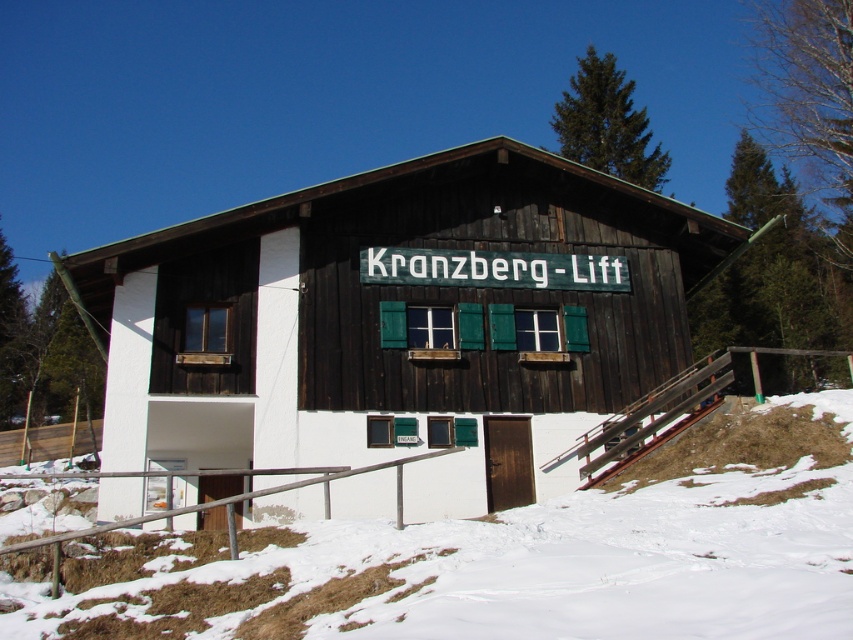
Question: Considering the real-world distances, which object is closest to the wooden cabin at center?

Choices:
 (A) white powdery snow at lower left
 (B) metal/wooden handrail at lower center

Answer: (B)

Question: Is wooden cabin at center to the right of metal/wooden handrail at lower center from the viewer's perspective?

Choices:
 (A) no
 (B) yes

Answer: (B)

Question: Which point appears farthest from the camera in this image?

Choices:
 (A) (404, 211)
 (B) (148, 532)

Answer: (A)

Question: Does wooden cabin at center appear on the right side of metal/wooden handrail at lower center?

Choices:
 (A) yes
 (B) no

Answer: (A)

Question: Which point is closer to the camera?

Choices:
 (A) metal/wooden handrail at lower center
 (B) white powdery snow at lower left
 (C) wooden cabin at center

Answer: (B)

Question: Does wooden cabin at center have a smaller size compared to white powdery snow at lower left?

Choices:
 (A) no
 (B) yes

Answer: (A)